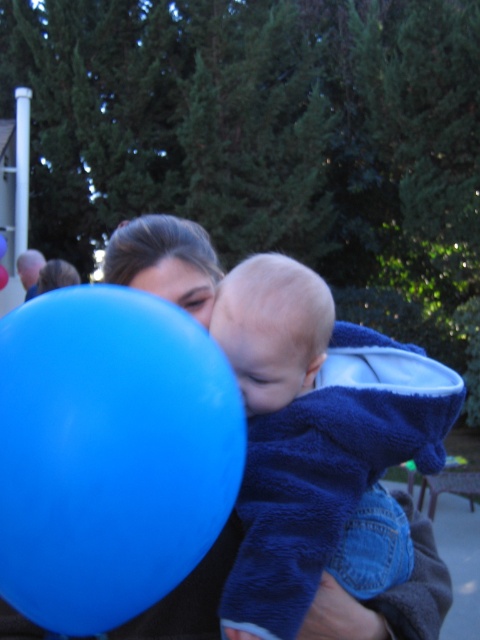
Question: Which of the following is the farthest from the observer?

Choices:
 (A) blue rubber balloon at left
 (B) blue rubber balloon at center
 (C) smooth skin face at center

Answer: (B)

Question: Does blue rubber balloon at left appear under smooth skin face at center?

Choices:
 (A) yes
 (B) no

Answer: (A)

Question: Which of the following is the closest to the observer?

Choices:
 (A) (139, 280)
 (B) (252, 340)

Answer: (B)

Question: Considering the relative positions of blue rubber balloon at left and matte skin face at center in the image provided, where is blue rubber balloon at left located with respect to matte skin face at center?

Choices:
 (A) right
 (B) left

Answer: (A)

Question: Among these points, which one is nearest to the camera?

Choices:
 (A) (92, 413)
 (B) (231, 301)
 (C) (168, 298)

Answer: (A)

Question: Does blue soft towel at center appear on the left side of matte skin face at center?

Choices:
 (A) yes
 (B) no

Answer: (B)